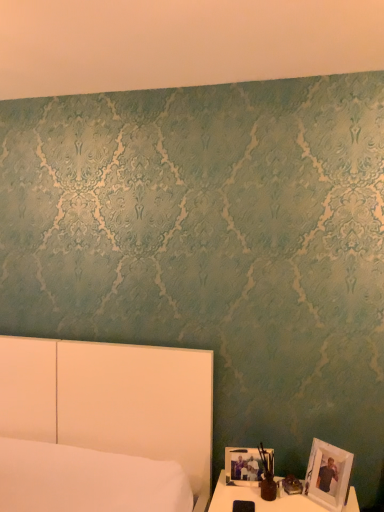
Describe the element at coordinates (244, 465) in the screenshot. This screenshot has height=512, width=384. I see `white matte picture frame at lower right, arranged as the first picture frame when viewed from the left` at that location.

Where is `white glossy table at lower right`? white glossy table at lower right is located at coordinates (258, 499).

Image resolution: width=384 pixels, height=512 pixels. In order to click on matte brown vase at lower right in this screenshot , I will do `click(267, 476)`.

Is white wooden picture frame at lower right, positioned as the second picture frame in left-to-right order, facing away from white glossy table at lower right?

No, white glossy table at lower right is not at the back of white wooden picture frame at lower right, positioned as the second picture frame in left-to-right order.

Who is smaller, white wooden picture frame at lower right, which is the first picture frame from right to left, or white glossy table at lower right?

With smaller size is white wooden picture frame at lower right, which is the first picture frame from right to left.

Is white wooden picture frame at lower right, which is the first picture frame from right to left, to the left or to the right of white glossy table at lower right in the image?

From the image, it's evident that white wooden picture frame at lower right, which is the first picture frame from right to left, is to the right of white glossy table at lower right.

Is white wooden picture frame at lower right, positioned as the second picture frame in left-to-right order, directly adjacent to white glossy table at lower right?

No, white wooden picture frame at lower right, positioned as the second picture frame in left-to-right order, is not touching white glossy table at lower right.

Is matte brown vase at lower right at the back of white matte picture frame at lower right, arranged as the first picture frame when viewed from the left?

No.

Is matte brown vase at lower right surrounded by white matte picture frame at lower right, arranged as the first picture frame when viewed from the left?

No, matte brown vase at lower right is not a part of white matte picture frame at lower right, arranged as the first picture frame when viewed from the left.

From the image's perspective, does white matte picture frame at lower right, the second picture frame viewed from the right, appear lower than matte brown vase at lower right?

Yes.

How different are the orientations of white matte picture frame at lower right, arranged as the first picture frame when viewed from the left, and matte brown vase at lower right in degrees?

4.54 degrees separate the facing orientations of white matte picture frame at lower right, arranged as the first picture frame when viewed from the left, and matte brown vase at lower right.

Could you tell me if white glossy table at lower right is turned towards matte brown vase at lower right?

No, white glossy table at lower right is not oriented towards matte brown vase at lower right.

From the image's perspective, relative to matte brown vase at lower right, is white glossy table at lower right above or below?

Based on their image positions, white glossy table at lower right is located beneath matte brown vase at lower right.

What's the angular difference between white glossy table at lower right and matte brown vase at lower right's facing directions?

There is a 2.83-degree angle between the facing directions of white glossy table at lower right and matte brown vase at lower right.

From the image's perspective, between matte brown vase at lower right and white glossy table at lower right, which one is located above?

matte brown vase at lower right.

From a real-world perspective, does matte brown vase at lower right stand above white glossy table at lower right?

Indeed, from a real-world perspective, matte brown vase at lower right stands above white glossy table at lower right.

Does point (261, 485) appear closer or farther from the camera than point (280, 480)?

Point (261, 485).

Could you tell me if matte brown vase at lower right is facing white glossy table at lower right?

No, matte brown vase at lower right does not turn towards white glossy table at lower right.

Is matte brown vase at lower right turned away from white matte picture frame at lower right, arranged as the first picture frame when viewed from the left?

Absolutely, matte brown vase at lower right is directed away from white matte picture frame at lower right, arranged as the first picture frame when viewed from the left.

Is point (263, 461) closer to viewer compared to point (247, 474)?

No, (263, 461) is further to viewer.

From their relative heights in the image, would you say matte brown vase at lower right is taller or shorter than white matte picture frame at lower right, the second picture frame viewed from the right?

Clearly, matte brown vase at lower right is taller compared to white matte picture frame at lower right, the second picture frame viewed from the right.

Is matte brown vase at lower right bigger than white matte picture frame at lower right, arranged as the first picture frame when viewed from the left?

Indeed, matte brown vase at lower right has a larger size compared to white matte picture frame at lower right, arranged as the first picture frame when viewed from the left.

In the image, is white wooden picture frame at lower right, which is the first picture frame from right to left, positioned in front of or behind matte brown vase at lower right?

white wooden picture frame at lower right, which is the first picture frame from right to left, is in front of matte brown vase at lower right.

Considering the relative sizes of white wooden picture frame at lower right, positioned as the second picture frame in left-to-right order, and matte brown vase at lower right in the image provided, is white wooden picture frame at lower right, positioned as the second picture frame in left-to-right order, thinner than matte brown vase at lower right?

No.

Where is `the 1st picture frame below the matte brown vase at lower right (from the image's perspective)`? This screenshot has width=384, height=512. the 1st picture frame below the matte brown vase at lower right (from the image's perspective) is located at coordinates (328, 475).

Is point (341, 455) closer or farther from the camera than point (262, 452)?

Point (341, 455) is closer to the camera than point (262, 452).

Does white glossy table at lower right come behind white matte picture frame at lower right, the second picture frame viewed from the right?

No, white glossy table at lower right is closer to the viewer.

Considering the sizes of white glossy table at lower right and white matte picture frame at lower right, the second picture frame viewed from the right, in the image, is white glossy table at lower right taller or shorter than white matte picture frame at lower right, the second picture frame viewed from the right,?

white glossy table at lower right is taller than white matte picture frame at lower right, the second picture frame viewed from the right.

From a real-world perspective, which object rests below the other?

white glossy table at lower right, from a real-world perspective.

From the white glossy table at lower right, count 1st picture frames backward and point to it. Please provide its 2D coordinates.

[(328, 475)]

Image resolution: width=384 pixels, height=512 pixels. What are the coordinates of `bedside lamp above the white matte picture frame at lower right, arranged as the first picture frame when viewed from the left (from the image's perspective)` in the screenshot? It's located at (267, 476).

Consider the image. Which object lies nearer to the anchor point white matte picture frame at lower right, the second picture frame viewed from the right, matte brown vase at lower right or white wooden picture frame at lower right, positioned as the second picture frame in left-to-right order?

The object closer to white matte picture frame at lower right, the second picture frame viewed from the right, is matte brown vase at lower right.

Considering their positions, is white glossy table at lower right positioned closer to white wooden picture frame at lower right, which is the first picture frame from right to left, than white matte picture frame at lower right, arranged as the first picture frame when viewed from the left?

white glossy table at lower right is positioned closer to the anchor white wooden picture frame at lower right, which is the first picture frame from right to left.

From the image, which object appears to be farther from matte brown vase at lower right, white glossy table at lower right or white wooden picture frame at lower right, which is the first picture frame from right to left?

The object further to matte brown vase at lower right is white wooden picture frame at lower right, which is the first picture frame from right to left.

Estimate the real-world distances between objects in this image. Which object is closer to white glossy table at lower right, white wooden picture frame at lower right, positioned as the second picture frame in left-to-right order, or white matte picture frame at lower right, the second picture frame viewed from the right?

white matte picture frame at lower right, the second picture frame viewed from the right.

Based on their spatial positions, is white wooden picture frame at lower right, positioned as the second picture frame in left-to-right order, or white glossy table at lower right closer to matte brown vase at lower right?

white glossy table at lower right is positioned closer to the anchor matte brown vase at lower right.

Considering their positions, is white matte picture frame at lower right, arranged as the first picture frame when viewed from the left, positioned further to matte brown vase at lower right than white wooden picture frame at lower right, which is the first picture frame from right to left?

white wooden picture frame at lower right, which is the first picture frame from right to left, is further to matte brown vase at lower right.

Estimate the real-world distances between objects in this image. Which object is further from white glossy table at lower right, white matte picture frame at lower right, arranged as the first picture frame when viewed from the left, or white wooden picture frame at lower right, which is the first picture frame from right to left?

A: white wooden picture frame at lower right, which is the first picture frame from right to left, is positioned further to the anchor white glossy table at lower right.

From the image, which object appears to be nearer to white matte picture frame at lower right, arranged as the first picture frame when viewed from the left, matte brown vase at lower right or white glossy table at lower right?

matte brown vase at lower right lies closer to white matte picture frame at lower right, arranged as the first picture frame when viewed from the left, than the other object.

The width and height of the screenshot is (384, 512). I want to click on bedside lamp between white glossy table at lower right and white matte picture frame at lower right, the second picture frame viewed from the right, from front to back, so click(267, 476).

Find the location of a particular element. This screenshot has height=512, width=384. picture frame between white glossy table at lower right and white matte picture frame at lower right, arranged as the first picture frame when viewed from the left, in the front-back direction is located at coordinates (328, 475).

At what (x,y) coordinates should I click in order to perform the action: click on bedside lamp located between white matte picture frame at lower right, the second picture frame viewed from the right, and white wooden picture frame at lower right, which is the first picture frame from right to left, in the left-right direction. Please return your answer as a coordinate pair (x, y). Looking at the image, I should click on (267, 476).

This screenshot has height=512, width=384. I want to click on table between matte brown vase at lower right and white wooden picture frame at lower right, which is the first picture frame from right to left, in the horizontal direction, so click(258, 499).